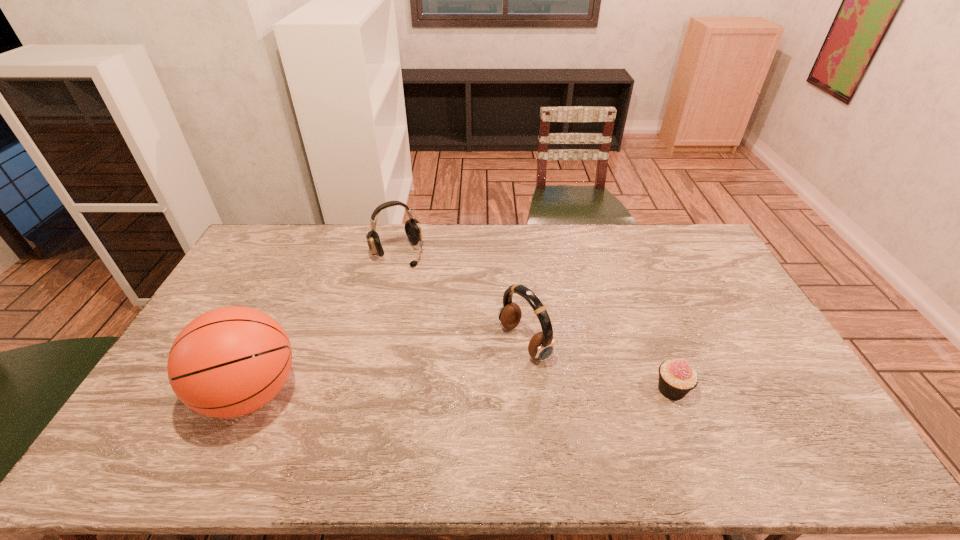
Where is `object situated at the near left corner`? The width and height of the screenshot is (960, 540). object situated at the near left corner is located at coordinates (228, 362).

In the image, there is a desktop. Where is `blank space at the far edge`? Image resolution: width=960 pixels, height=540 pixels. blank space at the far edge is located at coordinates (424, 241).

The width and height of the screenshot is (960, 540). I want to click on free spot at the near edge of the desktop, so click(x=461, y=417).

I want to click on free spot at the left edge of the desktop, so click(243, 269).

At what (x,y) coordinates should I click in order to perform the action: click on vacant region at the far left corner of the desktop. Please return your answer as a coordinate pair (x, y). Looking at the image, I should click on (272, 247).

Where is `blank space at the near right corner of the desktop`? The width and height of the screenshot is (960, 540). blank space at the near right corner of the desktop is located at coordinates (755, 409).

Locate an element on the screen. The width and height of the screenshot is (960, 540). vacant space in between the farthest object and the shortest object is located at coordinates (535, 321).

At what (x,y) coordinates should I click in order to perform the action: click on blank region between the nearer headset and the cupcake. Please return your answer as a coordinate pair (x, y). Image resolution: width=960 pixels, height=540 pixels. Looking at the image, I should click on (598, 366).

Locate an element on the screen. The width and height of the screenshot is (960, 540). vacant area between the rightmost object and the farther headset is located at coordinates (535, 321).

You are a GUI agent. You are given a task and a screenshot of the screen. Output one action in this format:
    pyautogui.click(x=<x>, y=<y>)
    Task: Click on the vacant space that is in between the tallest object and the third object from left to right
    
    Given the screenshot: What is the action you would take?
    pyautogui.click(x=388, y=368)